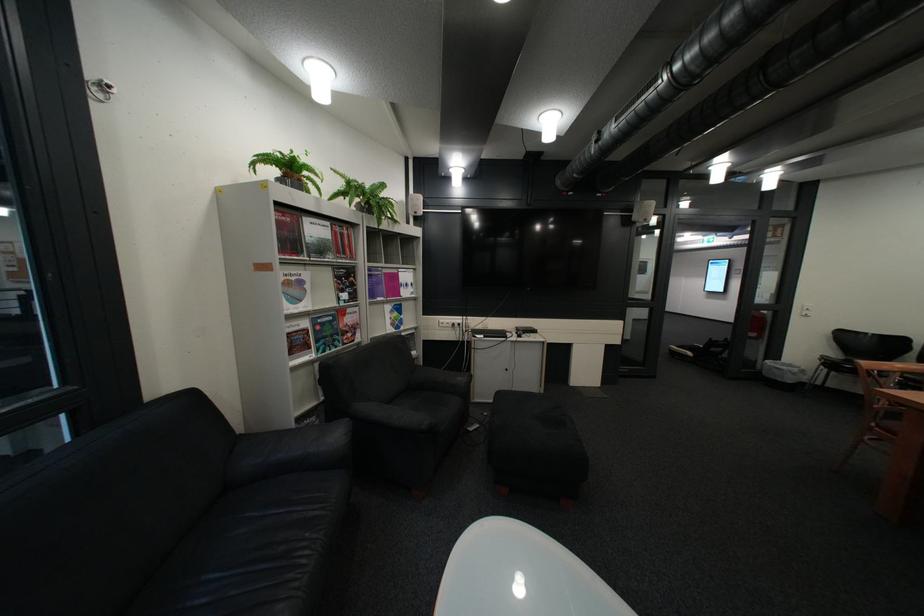
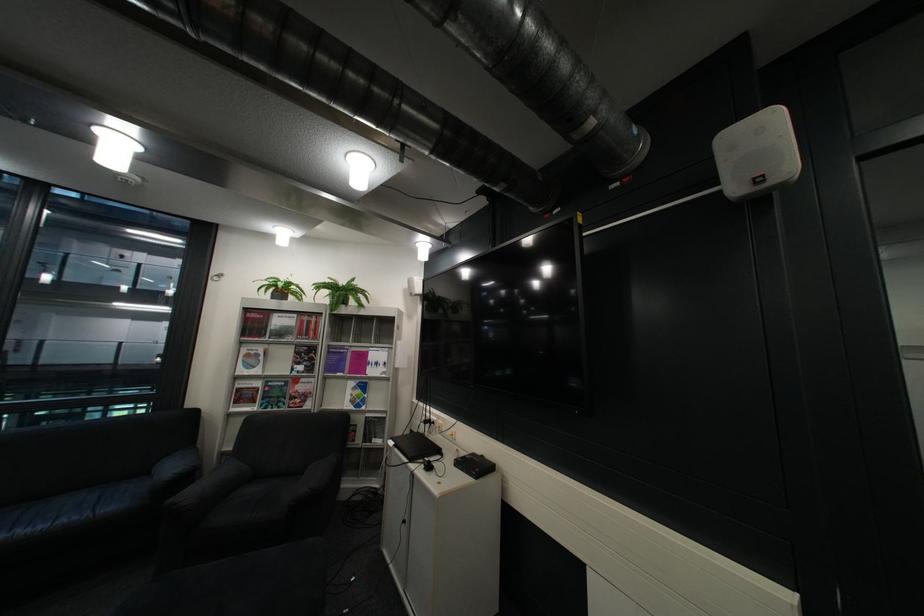
Locate, in the second image, the point that corresponds to (x=429, y=353) in the first image.

(393, 442)